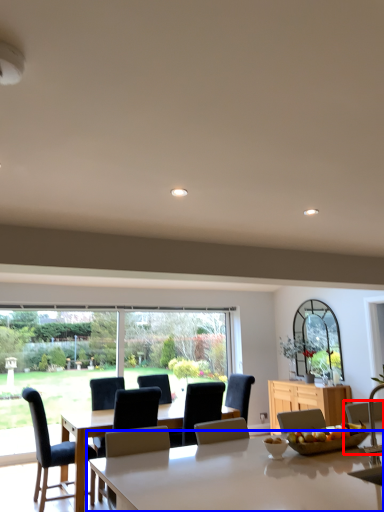
Question: Among these objects, which one is farthest to the camera, chair (highlighted by a red box) or table (highlighted by a blue box)?

Choices:
 (A) chair
 (B) table

Answer: (A)